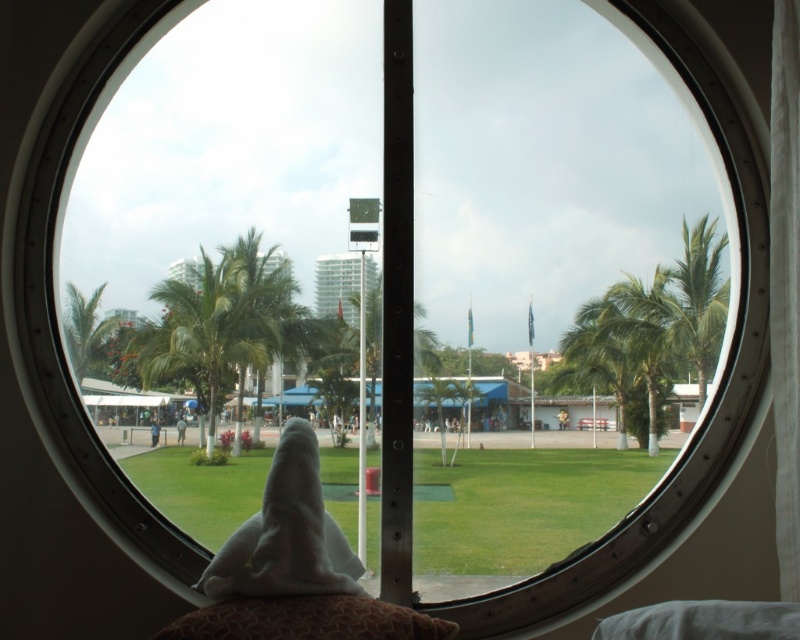
Is point (788, 77) more distant than point (112, 316)?

No, (788, 77) is closer to viewer.

What do you see at coordinates (786, 285) in the screenshot?
I see `white textured curtain at center` at bounding box center [786, 285].

At what (x,y) coordinates should I click in order to perform the action: click on white textured curtain at center. Please return your answer as a coordinate pair (x, y). This screenshot has height=640, width=800. Looking at the image, I should click on (786, 285).

Is green leafy palm tree at center-right above green leafy palm tree at right?

Actually, green leafy palm tree at center-right is below green leafy palm tree at right.

Which is in front, point (594, 339) or point (706, 262)?

Point (706, 262) is in front.

Find the location of a particular element. The height and width of the screenshot is (640, 800). green leafy palm tree at center-right is located at coordinates (618, 362).

Is white textured curtain at center above green leafy palm tree at center-right?

Yes, white textured curtain at center is above green leafy palm tree at center-right.

Can you confirm if white textured curtain at center is wider than green leafy palm tree at center-right?

No, white textured curtain at center is not wider than green leafy palm tree at center-right.

Image resolution: width=800 pixels, height=640 pixels. Identify the location of white textured curtain at center. (786, 285).